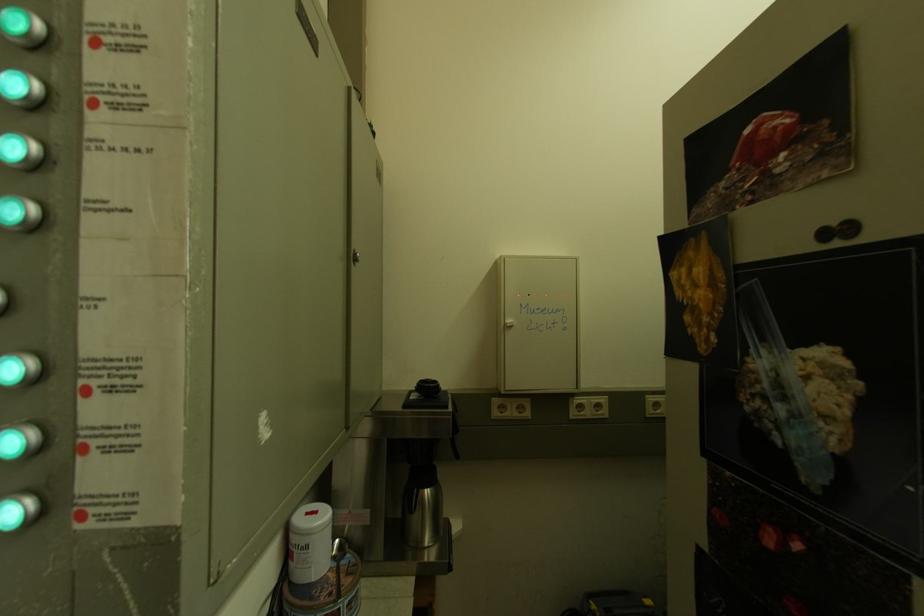
Image resolution: width=924 pixels, height=616 pixels. What do you see at coordinates (409, 493) in the screenshot? I see `a black filter holder` at bounding box center [409, 493].